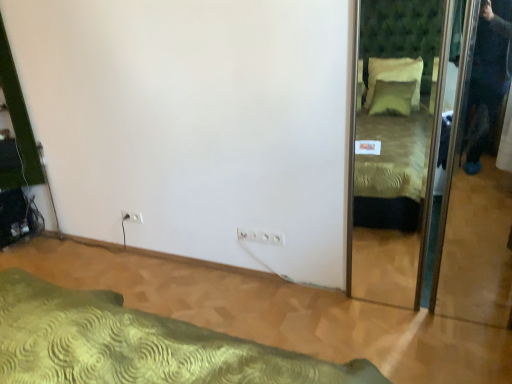
The width and height of the screenshot is (512, 384). What are the coordinates of `blank space situated above green textured bed at lower left (from a real-world perspective)` in the screenshot? It's located at (211, 296).